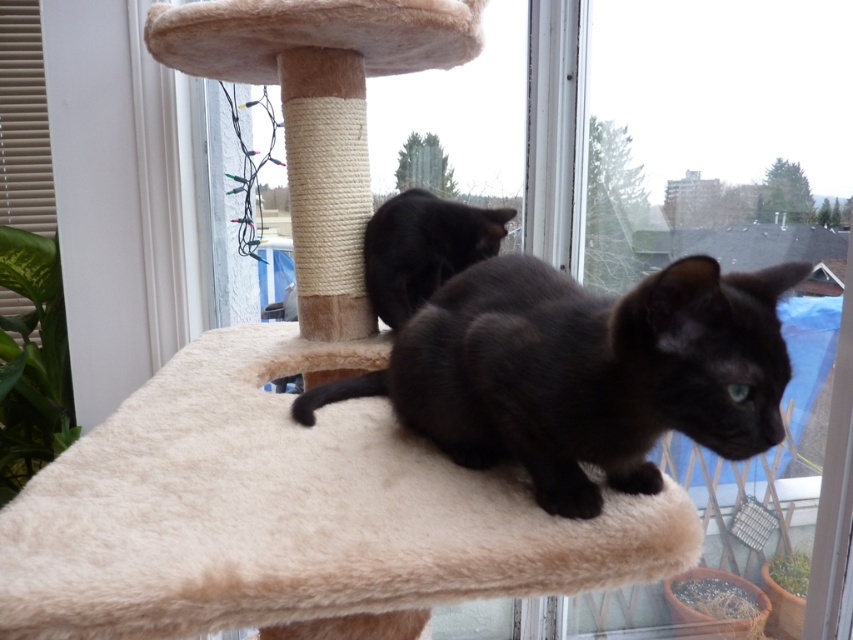
You are a cat owner who wants to place a small toy on the beige plush cat bed at center. The coordinates given are in a normalized system where 0 is the bottom left corner and 1 is the top right corner of the image. Can you confirm if the point at (291, 509) falls within the beige plush cat bed at center?

The point at (291, 509) is on the beige plush cat bed at center, so placing the toy there would be appropriate.

You are standing in the room and see the point at coordinates (585, 371). What is located at that point?

The point at coordinates (585, 371) corresponds to the shiny black cat at center.